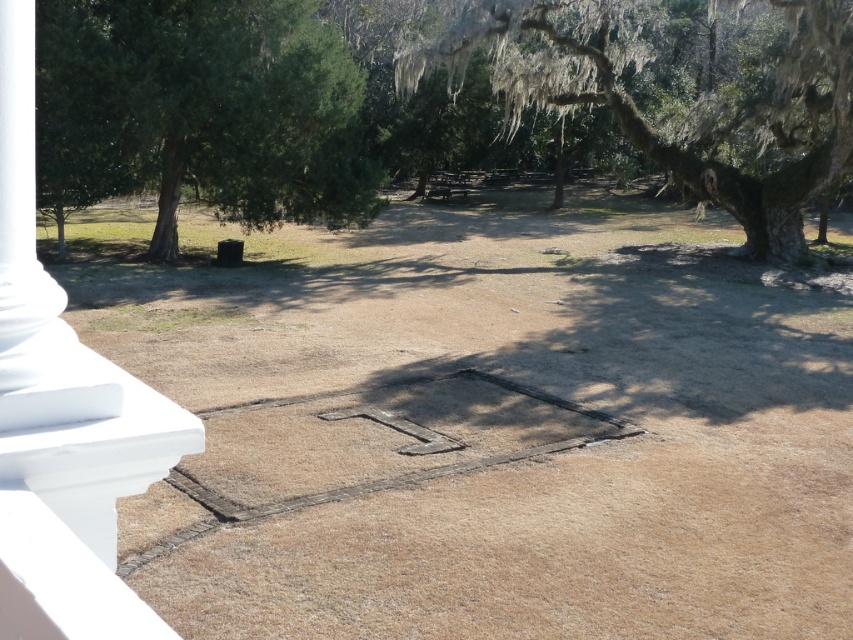
In the scene shown: You are standing on a porch and looking out at the scene. You notice two trees in the distance. The first is a green leafy tree at upper left and the second is a green mossy tree at upper right. Which tree appears closer to you in the image?

The green leafy tree at upper left appears closer because it is positioned below the green mossy tree at upper right, indicating it is in a lower part of the visual plane and thus closer to the viewer.

You are standing at the bottom left corner of the image where the white column is located. You want to walk towards the green leafy tree at upper left. Which direction should you head?

You should head towards the upper left direction to reach the green leafy tree at upper left, as its 2D location is at point (199, 112).